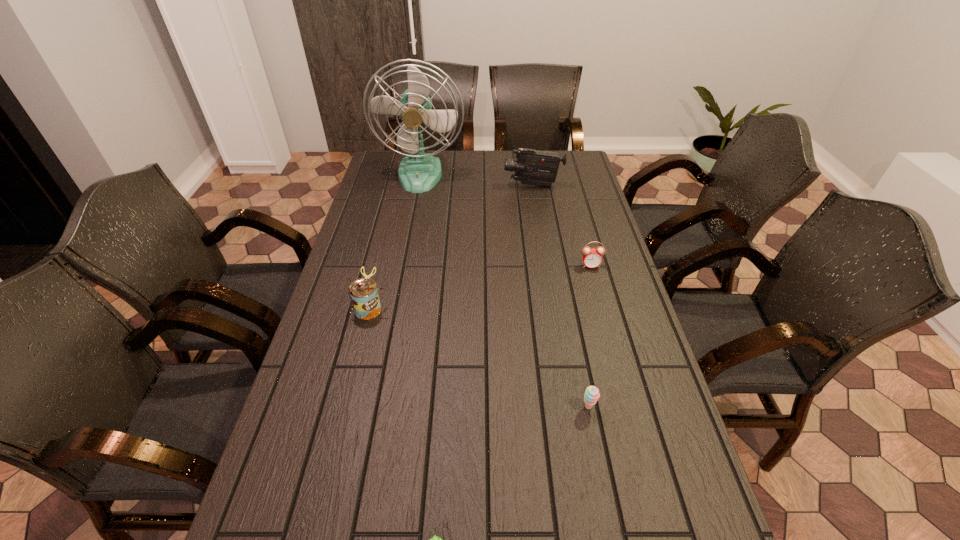
You are a GUI agent. You are given a task and a screenshot of the screen. Output one action in this format:
    pyautogui.click(x=<x>, y=<y>)
    Task: Click on the free spot located on the clock face of the alarm clock
    The width and height of the screenshot is (960, 540).
    Given the screenshot: What is the action you would take?
    pyautogui.click(x=594, y=280)

You are a GUI agent. You are given a task and a screenshot of the screen. Output one action in this format:
    pyautogui.click(x=<x>, y=<y>)
    Task: Click on the free space located 0.180m on the left of the sherbert
    Image resolution: width=960 pixels, height=540 pixels.
    Given the screenshot: What is the action you would take?
    pyautogui.click(x=506, y=407)

You are a GUI agent. You are given a task and a screenshot of the screen. Output one action in this format:
    pyautogui.click(x=<x>, y=<y>)
    Task: Click on the object present at the far edge
    
    Given the screenshot: What is the action you would take?
    pyautogui.click(x=419, y=172)

Identify the location of fan present at the left edge. (419, 172).

Where is `can at the left edge`? Image resolution: width=960 pixels, height=540 pixels. can at the left edge is located at coordinates (363, 292).

In order to click on camcorder that is at the right edge in this screenshot , I will do `click(532, 167)`.

Find the location of a particular element. The height and width of the screenshot is (540, 960). alarm clock that is at the right edge is located at coordinates coord(592,258).

What are the coordinates of `object that is at the far left corner` in the screenshot? It's located at (419, 172).

In the image, there is a desktop. At what (x,y) coordinates should I click in order to perform the action: click on free space at the far edge. Please return your answer as a coordinate pair (x, y). Looking at the image, I should click on (460, 154).

This screenshot has width=960, height=540. What are the coordinates of `vacant space at the left edge of the desktop` in the screenshot? It's located at (348, 286).